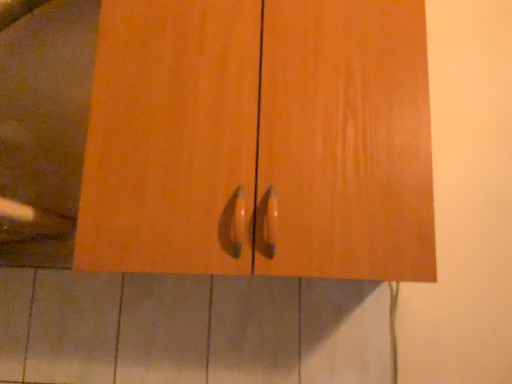
The width and height of the screenshot is (512, 384). What do you see at coordinates (260, 139) in the screenshot?
I see `matte wood cupboard at center` at bounding box center [260, 139].

Identify the location of matte wood cupboard at center. (260, 139).

Find the location of `matte wood cupboard at center`. matte wood cupboard at center is located at coordinates (260, 139).